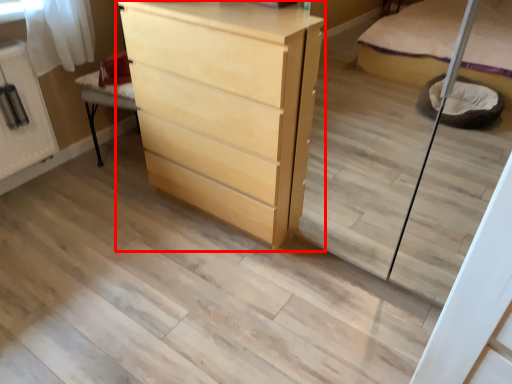
Question: Observing the image, what is the correct spatial positioning of chest of drawers (annotated by the red box) in reference to cabinetry?

Choices:
 (A) left
 (B) right

Answer: (B)